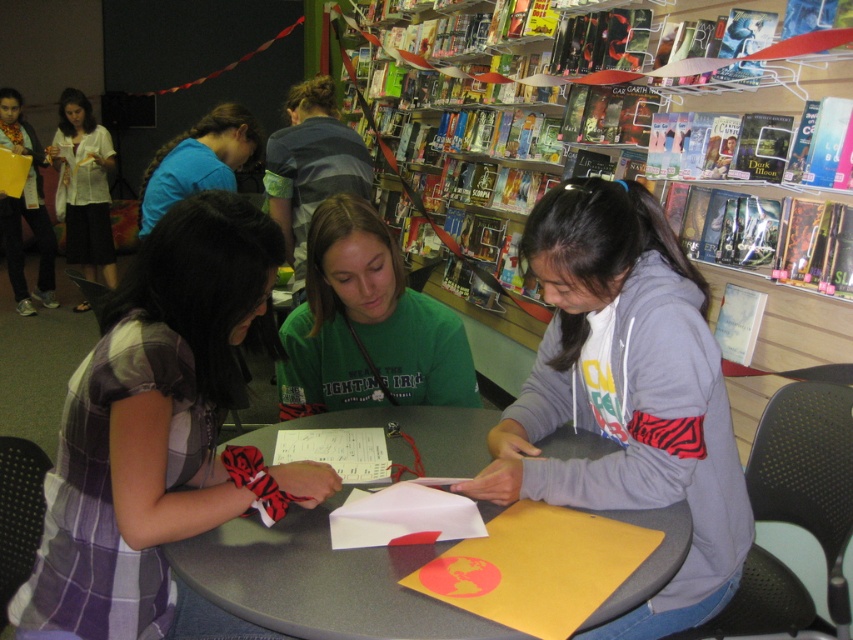
You are a customer trying to find an aisle in the bookstore. You see the smooth gray table at center and the matte white blouse at left. Which object is located to the right of the other?

The smooth gray table at center is positioned on the right side of matte white blouse at left.

You are a photographer taking a picture of the group at the table. You want to ensure that the green matte shirt at center and the matte white blouse at left are both in focus. Which clothing item should you adjust the camera focus for first to account for their height difference?

The green matte shirt at center is shorter than the matte white blouse at left, so you should focus on the green matte shirt at center first since it is closer to the camera.